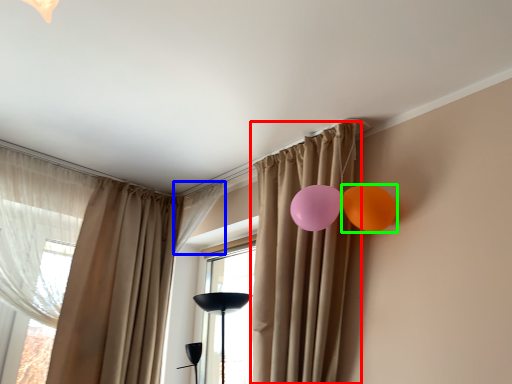
Question: Which object is the farthest from curtain (highlighted by a red box)? Choose among these: curtain (highlighted by a blue box) or balloon (highlighted by a green box).

Choices:
 (A) curtain
 (B) balloon

Answer: (A)